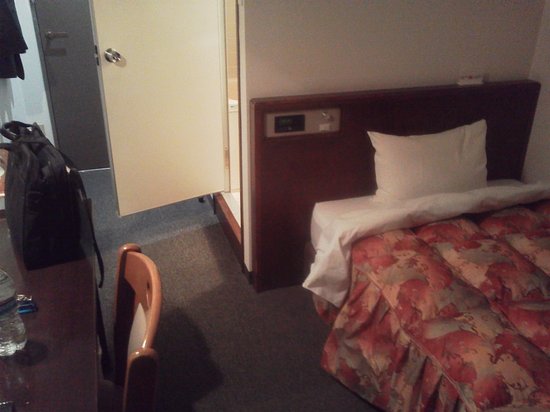
The width and height of the screenshot is (550, 412). I want to click on white door that's open, so click(152, 80).